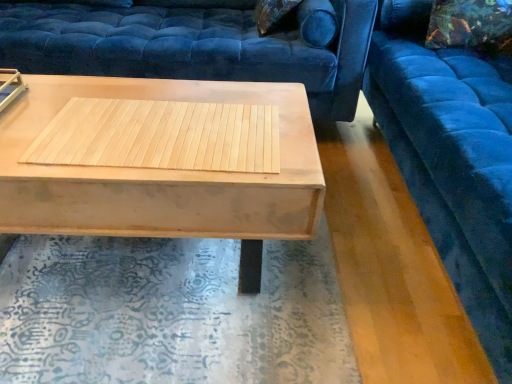
Locate an element on the screen. The height and width of the screenshot is (384, 512). natural wood mat at center is located at coordinates (160, 136).

Where is `velvet blue studio couch at upper right, which is the first studio couch from right to left`? The height and width of the screenshot is (384, 512). velvet blue studio couch at upper right, which is the first studio couch from right to left is located at coordinates (451, 160).

At what (x,y) coordinates should I click in order to perform the action: click on velvet blue studio couch at upper center, placed as the second studio couch when sorted from right to left. Please return your answer as a coordinate pair (x, y). Image resolution: width=512 pixels, height=384 pixels. Looking at the image, I should click on (191, 47).

Where is `natural wood mat at center`? The height and width of the screenshot is (384, 512). natural wood mat at center is located at coordinates (160, 136).

Which is more to the left, natural wood mat at center or light wood/texture coffee table at center?

light wood/texture coffee table at center is more to the left.

From a real-world perspective, who is located higher, natural wood mat at center or light wood/texture coffee table at center?

natural wood mat at center is physically above.

From the image's perspective, is natural wood mat at center located above or below light wood/texture coffee table at center?

From the image's perspective, natural wood mat at center appears above light wood/texture coffee table at center.

Is light wood/texture coffee table at center at the back of natural wood mat at center?

That's right, natural wood mat at center is facing away from light wood/texture coffee table at center.

From the picture: Is velvet floral pillow at upper right far from natural wood mat at center?

velvet floral pillow at upper right is positioned a significant distance from natural wood mat at center.

Is velvet floral pillow at upper right further to the viewer compared to natural wood mat at center?

That is True.

Is natural wood mat at center completely or partially inside velvet floral pillow at upper right?

No, natural wood mat at center is located outside of velvet floral pillow at upper right.

Is velvet floral pillow at upper right taller or shorter than natural wood mat at center?

In the image, velvet floral pillow at upper right appears to be taller than natural wood mat at center.

Considering the sizes of light wood/texture coffee table at center and velvet floral pillow at upper right in the image, is light wood/texture coffee table at center wider or thinner than velvet floral pillow at upper right?

In the image, light wood/texture coffee table at center appears to be wider than velvet floral pillow at upper right.

Which object is positioned more to the left, light wood/texture coffee table at center or velvet floral pillow at upper right?

Positioned to the left is light wood/texture coffee table at center.

Who is shorter, light wood/texture coffee table at center or velvet floral pillow at upper right?

velvet floral pillow at upper right is shorter.

Which is behind, point (508, 297) or point (136, 158)?

The point (136, 158) is behind.

Between velvet blue studio couch at upper right, which is the first studio couch from right to left, and natural wood mat at center, which one is positioned in front?

velvet blue studio couch at upper right, which is the first studio couch from right to left, is more forward.

Is natural wood mat at center a part of velvet blue studio couch at upper right, the 2th studio couch in the left-to-right sequence?

No, natural wood mat at center is not surrounded by velvet blue studio couch at upper right, the 2th studio couch in the left-to-right sequence.

Based on the photo, is light wood/texture coffee table at center bigger or smaller than velvet blue studio couch at upper center, placed as the second studio couch when sorted from right to left?

In the image, light wood/texture coffee table at center appears to be smaller than velvet blue studio couch at upper center, placed as the second studio couch when sorted from right to left.

How many degrees apart are the facing directions of light wood/texture coffee table at center and velvet blue studio couch at upper center, acting as the 1th studio couch starting from the left?

light wood/texture coffee table at center and velvet blue studio couch at upper center, acting as the 1th studio couch starting from the left, are facing 0.446 degrees away from each other.

Does point (279, 101) appear closer or farther from the camera than point (46, 41)?

Clearly, point (279, 101) is closer to the camera than point (46, 41).

Which object is further away from the camera taking this photo, light wood/texture coffee table at center or velvet blue studio couch at upper center, placed as the second studio couch when sorted from right to left?

velvet blue studio couch at upper center, placed as the second studio couch when sorted from right to left, is behind.

Is point (287, 206) behind point (461, 56)?

No, it is not.

I want to click on the 2nd studio couch directly above the light wood/texture coffee table at center (from a real-world perspective), so click(451, 160).

Considering the sizes of objects light wood/texture coffee table at center and velvet blue studio couch at upper right, which is the first studio couch from right to left, in the image provided, who is smaller, light wood/texture coffee table at center or velvet blue studio couch at upper right, which is the first studio couch from right to left,?

Smaller between the two is light wood/texture coffee table at center.

From a real-world perspective, which is physically above, light wood/texture coffee table at center or velvet blue studio couch at upper right, which is the first studio couch from right to left?

velvet blue studio couch at upper right, which is the first studio couch from right to left, is physically above.

How much distance is there between velvet blue studio couch at upper center, placed as the second studio couch when sorted from right to left, and velvet floral pillow at upper right?

A: The distance of velvet blue studio couch at upper center, placed as the second studio couch when sorted from right to left, from velvet floral pillow at upper right is 31.76 inches.

Can you tell me how much velvet blue studio couch at upper center, acting as the 1th studio couch starting from the left, and velvet floral pillow at upper right differ in facing direction?

There is a 0.597-degree angle between the facing directions of velvet blue studio couch at upper center, acting as the 1th studio couch starting from the left, and velvet floral pillow at upper right.

What are the coordinates of `pillow located on the right of velvet blue studio couch at upper center, placed as the second studio couch when sorted from right to left` in the screenshot? It's located at (471, 24).

Is velvet blue studio couch at upper center, acting as the 1th studio couch starting from the left, inside or outside of velvet floral pillow at upper right?

velvet blue studio couch at upper center, acting as the 1th studio couch starting from the left, cannot be found inside velvet floral pillow at upper right.

The width and height of the screenshot is (512, 384). I want to click on wood above the light wood/texture coffee table at center (from a real-world perspective), so click(x=160, y=136).

This screenshot has width=512, height=384. In the image, there is a natural wood mat at center. In order to click on pillow above it (from the image's perspective) in this screenshot , I will do `click(471, 24)`.

From the image, which object appears to be farther from velvet blue studio couch at upper right, which is the first studio couch from right to left, velvet floral pillow at upper right or natural wood mat at center?

natural wood mat at center is further to velvet blue studio couch at upper right, which is the first studio couch from right to left.

Looking at the image, which one is located closer to velvet floral pillow at upper right, natural wood mat at center or velvet blue studio couch at upper right, the 2th studio couch in the left-to-right sequence?

Based on the image, velvet blue studio couch at upper right, the 2th studio couch in the left-to-right sequence, appears to be nearer to velvet floral pillow at upper right.

Estimate the real-world distances between objects in this image. Which object is closer to velvet floral pillow at upper right, light wood/texture coffee table at center or velvet blue studio couch at upper right, the 2th studio couch in the left-to-right sequence?

The object closer to velvet floral pillow at upper right is velvet blue studio couch at upper right, the 2th studio couch in the left-to-right sequence.

From the image, which object appears to be farther from velvet floral pillow at upper right, light wood/texture coffee table at center or natural wood mat at center?

Among the two, natural wood mat at center is located further to velvet floral pillow at upper right.

Which object lies nearer to the anchor point velvet blue studio couch at upper right, the 2th studio couch in the left-to-right sequence, light wood/texture coffee table at center or velvet blue studio couch at upper center, acting as the 1th studio couch starting from the left?

light wood/texture coffee table at center is positioned closer to the anchor velvet blue studio couch at upper right, the 2th studio couch in the left-to-right sequence.

Estimate the real-world distances between objects in this image. Which object is closer to natural wood mat at center, velvet floral pillow at upper right or velvet blue studio couch at upper center, placed as the second studio couch when sorted from right to left?

velvet blue studio couch at upper center, placed as the second studio couch when sorted from right to left.

Considering their positions, is velvet blue studio couch at upper center, acting as the 1th studio couch starting from the left, positioned further to velvet blue studio couch at upper right, the 2th studio couch in the left-to-right sequence, than light wood/texture coffee table at center?

velvet blue studio couch at upper center, acting as the 1th studio couch starting from the left.

Looking at the image, which one is located closer to velvet floral pillow at upper right, light wood/texture coffee table at center or velvet blue studio couch at upper center, placed as the second studio couch when sorted from right to left?

velvet blue studio couch at upper center, placed as the second studio couch when sorted from right to left, is positioned closer to the anchor velvet floral pillow at upper right.

The image size is (512, 384). Identify the location of pillow between natural wood mat at center and velvet blue studio couch at upper right, which is the first studio couch from right to left, in the horizontal direction. pyautogui.click(x=471, y=24).

You are a GUI agent. You are given a task and a screenshot of the screen. Output one action in this format:
    pyautogui.click(x=<x>, y=<y>)
    Task: Click on the pillow situated between velvet blue studio couch at upper center, placed as the second studio couch when sorted from right to left, and velvet blue studio couch at upper right, which is the first studio couch from right to left, from left to right
    This screenshot has width=512, height=384.
    Given the screenshot: What is the action you would take?
    (x=471, y=24)

At what (x,y) coordinates should I click in order to perform the action: click on wood between light wood/texture coffee table at center and velvet blue studio couch at upper right, which is the first studio couch from right to left, in the horizontal direction. Please return your answer as a coordinate pair (x, y). Looking at the image, I should click on (160, 136).

Find the location of `wood between velvet blue studio couch at upper center, placed as the second studio couch when sorted from right to left, and velvet blue studio couch at upper right, the 2th studio couch in the left-to-right sequence`. wood between velvet blue studio couch at upper center, placed as the second studio couch when sorted from right to left, and velvet blue studio couch at upper right, the 2th studio couch in the left-to-right sequence is located at coordinates (160, 136).